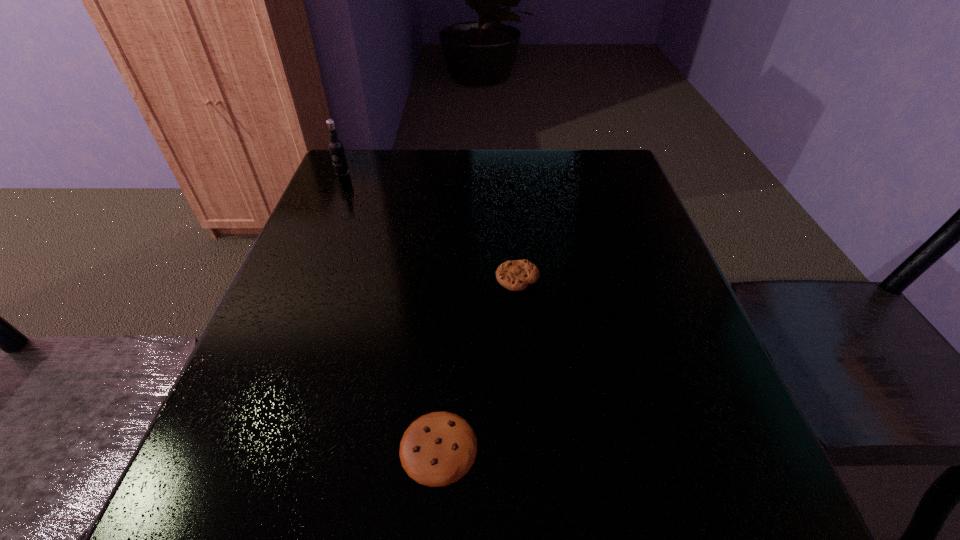
Select which object is the closest to the left cookie. Please provide its 2D coordinates. Your answer should be formatted as a tuple, i.e. [(x, y)], where the tuple contains the x and y coordinates of a point satisfying the conditions above.

[(516, 275)]

You are a GUI agent. You are given a task and a screenshot of the screen. Output one action in this format:
    pyautogui.click(x=<x>, y=<y>)
    Task: Click on the vacant space that satisfies the following two spatial constraints: 1. on the back side of the shortest object; 2. on the right side of the second tallest object
    
    Given the screenshot: What is the action you would take?
    pyautogui.click(x=450, y=279)

At what (x,y) coordinates should I click in order to perform the action: click on free space in the image that satisfies the following two spatial constraints: 1. on the label of the second object from right to left; 2. on the left side of the leftmost object. Please return your answer as a coordinate pair (x, y). Looking at the image, I should click on (225, 447).

Image resolution: width=960 pixels, height=540 pixels. What are the coordinates of `free location that satisfies the following two spatial constraints: 1. on the label of the farther cookie; 2. on the right side of the tallest object` in the screenshot? It's located at (297, 279).

At what (x,y) coordinates should I click in order to perform the action: click on free space in the image that satisfies the following two spatial constraints: 1. on the label of the taller cookie; 2. on the left side of the root beer. Please return your answer as a coordinate pair (x, y). Image resolution: width=960 pixels, height=540 pixels. Looking at the image, I should click on (297, 279).

The width and height of the screenshot is (960, 540). Identify the location of free location that satisfies the following two spatial constraints: 1. on the label of the leftmost object; 2. on the left side of the shorter cookie. (225, 447).